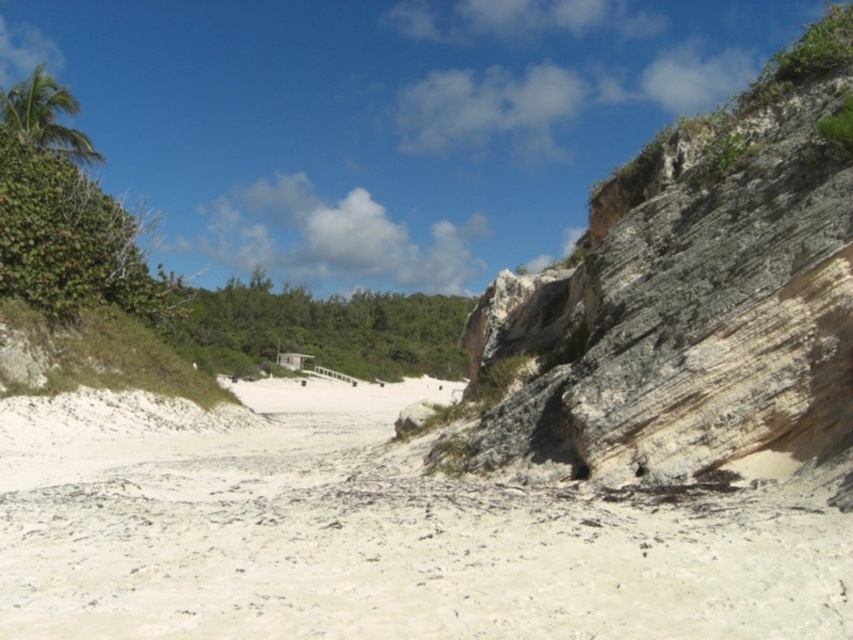
Question: Which object appears farthest from the camera in this image?

Choices:
 (A) green leafy palm tree at upper left
 (B) white sandy beach at center
 (C) green leafy shrubs at center
 (D) green leafy bush at upper left

Answer: (C)

Question: Does green leafy shrubs at center appear under green leafy bush at upper left?

Choices:
 (A) no
 (B) yes

Answer: (B)

Question: Estimate the real-world distances between objects in this image. Which object is closer to the white sandy beach at center?

Choices:
 (A) gray rocky cliff at right
 (B) green leafy palm tree at upper left

Answer: (A)

Question: Is green leafy shrubs at center to the left of green leafy palm tree at upper left from the viewer's perspective?

Choices:
 (A) no
 (B) yes

Answer: (A)

Question: Which point appears closest to the camera in this image?

Choices:
 (A) (36, 147)
 (B) (38, 205)

Answer: (B)

Question: Is gray rocky cliff at right below green leafy shrubs at center?

Choices:
 (A) yes
 (B) no

Answer: (B)